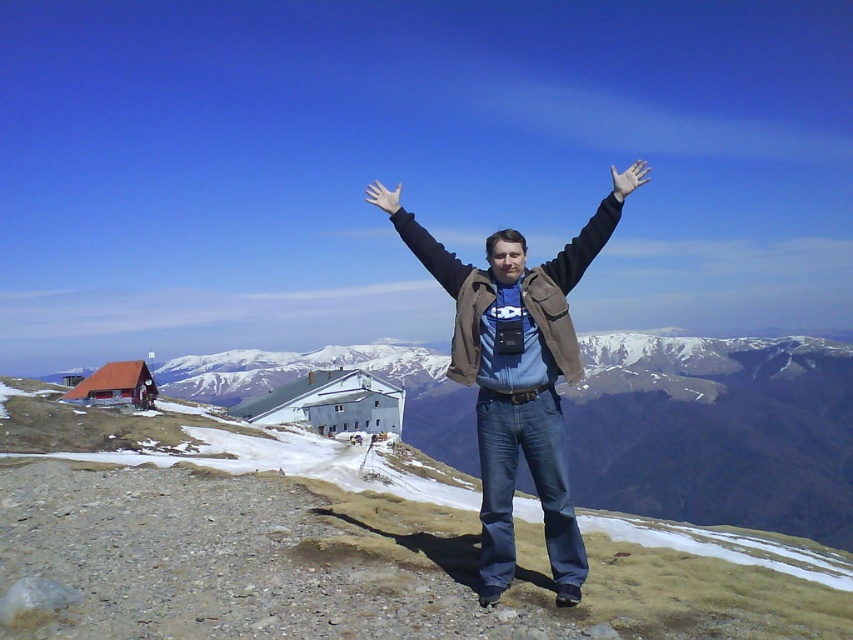
You are a photographer trying to capture a clear shot of the white matte hand at upper center without the black matte arm at center blocking it. Based on their positions, is this possible?

The black matte arm at center is located below the white matte hand at upper center, so the hand is above the arm. This means the arm is below the hand and would not block the view of the white matte hand at upper center. Therefore, you can capture a clear shot of the white matte hand at upper center without obstruction from the black matte arm at center.

You are a photographer trying to capture a wide landscape shot. You have two arms attached to your chest camera, the black leather arm at center and the black matte arm at center. To ensure both arms are in the frame, what is the minimum distance you need to step back from them?

The minimum distance you need to step back is 17.21 meters to ensure both the black leather arm at center and the black matte arm at center are in the frame since they are 17.21 meters apart.

You are a hiker trying to locate your gear. You see the brown leather jacket at center. Based on the coordinates provided, is the jacket closer to the top or bottom of the image?

The brown leather jacket at center is located at point 0.598 on the vertical axis, which places it closer to the bottom of the image since the coordinate system starts from the top left corner.